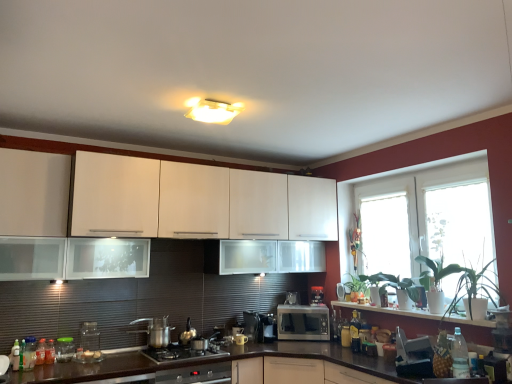
Image resolution: width=512 pixels, height=384 pixels. I want to click on empty space that is ontop of satin silver microwave at center, so pos(302,307).